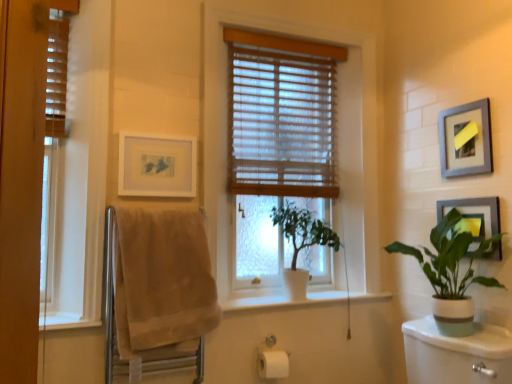
Where is `free space above wooden blinds at center (from a real-world perspective)`? The width and height of the screenshot is (512, 384). free space above wooden blinds at center (from a real-world perspective) is located at coordinates (292, 42).